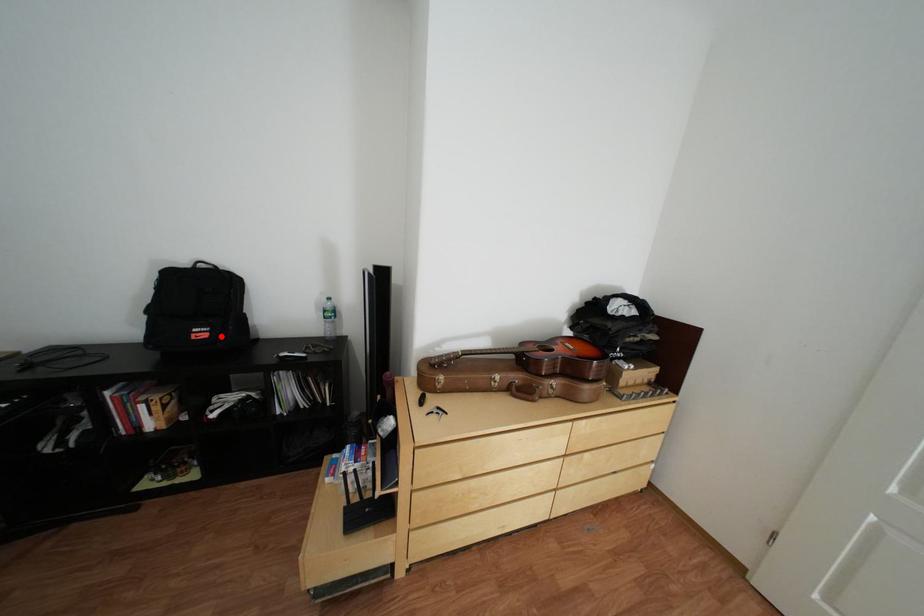
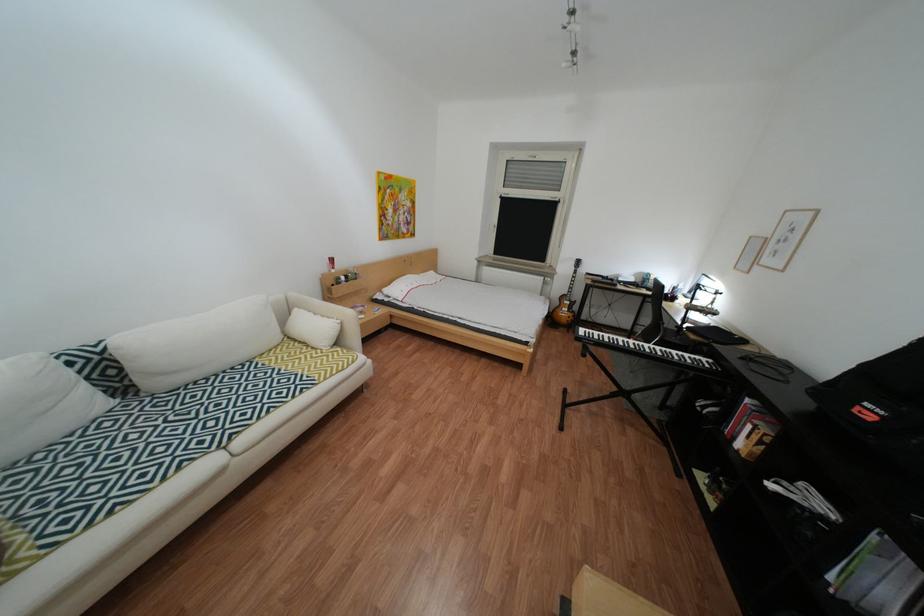
Where in the second image is the point corresponding to the highlighted location from the first image?

(886, 419)